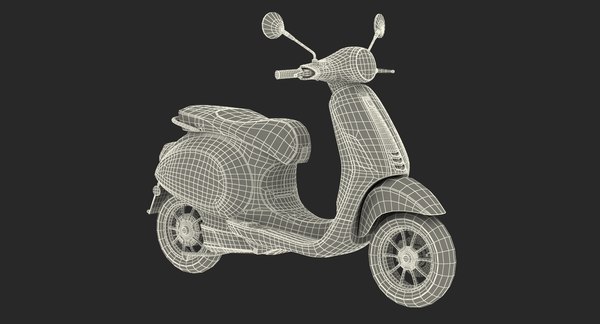
Where is `backside of right mirror`? The image size is (600, 324). backside of right mirror is located at coordinates (276, 25).